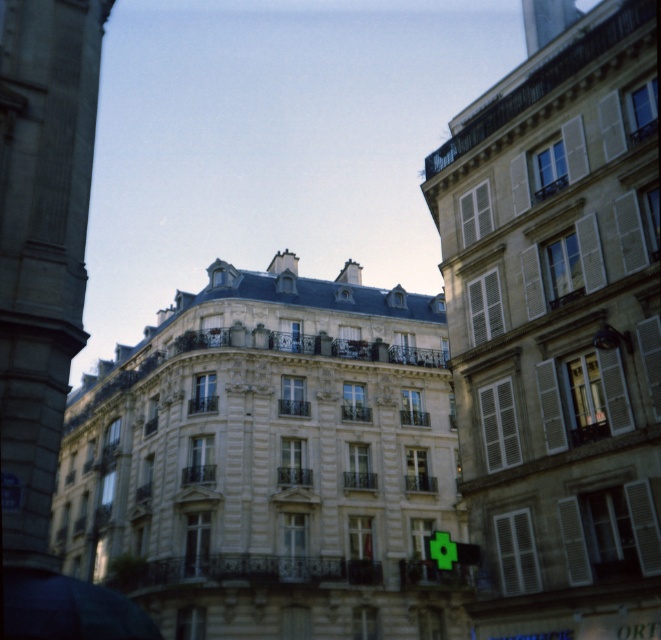
Question: Is smooth stone tower at left closer to the viewer compared to metallic silver tower at upper right?

Choices:
 (A) yes
 (B) no

Answer: (A)

Question: Which of the following is the closest to the observer?

Choices:
 (A) (570, 3)
 (B) (551, 611)
 (C) (50, 561)

Answer: (C)

Question: Is smooth beige building at center smaller than dark blue fabric umbrella at lower left?

Choices:
 (A) no
 (B) yes

Answer: (A)

Question: Which point appears farthest from the camera in this image?

Choices:
 (A) click(x=551, y=1)
 (B) click(x=61, y=156)

Answer: (A)

Question: From the image, what is the correct spatial relationship of smooth stone tower at left in relation to metallic silver tower at upper right?

Choices:
 (A) right
 (B) left

Answer: (B)

Question: Which point appears closest to the camera in this image?

Choices:
 (A) (22, 504)
 (B) (34, 621)

Answer: (B)